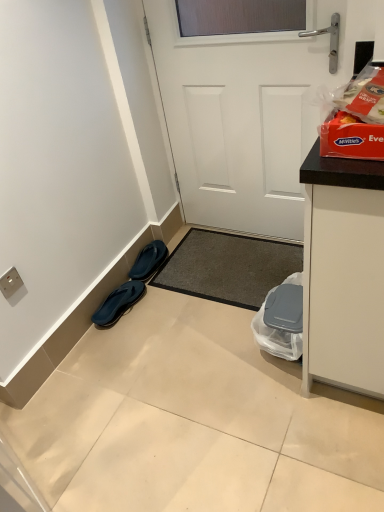
Find the location of a particular element. vacant space to the right of black rubber flip-flops at lower left, the second footwear when ordered from top to bottom is located at coordinates (160, 304).